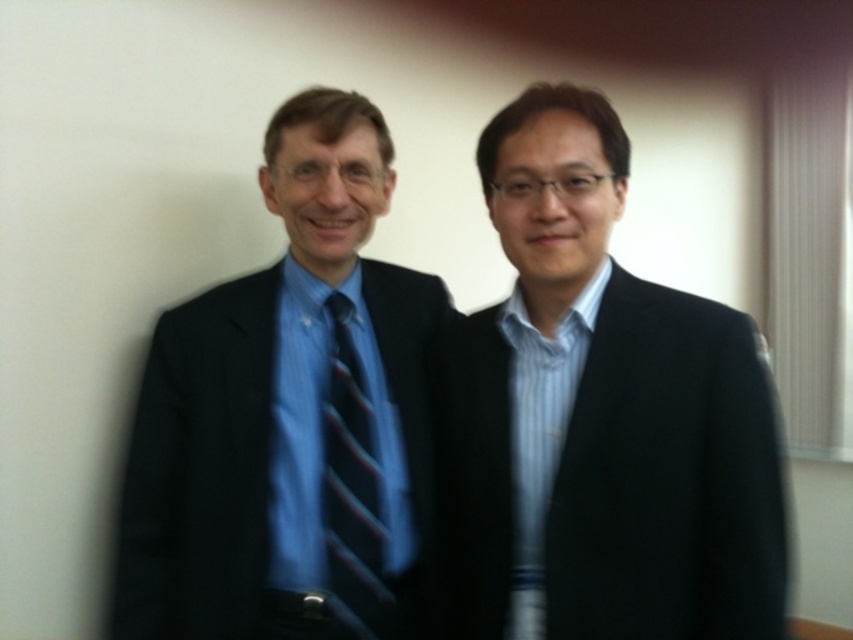
Consider the image. Is matte black suit at right below blue striped tie at center?

No, matte black suit at right is not below blue striped tie at center.

Can you confirm if matte black suit at right is wider than blue striped tie at center?

Correct, the width of matte black suit at right exceeds that of blue striped tie at center.

Is point (596, 289) behind point (370, 532)?

No, it is in front of (370, 532).

In order to click on matte black suit at right in this screenshot , I will do `click(605, 416)`.

Does matte black suit at right have a greater width compared to matte black suit at left?

No, matte black suit at right is not wider than matte black suit at left.

Where is `matte black suit at right`? matte black suit at right is located at coordinates (605, 416).

Who is higher up, matte black suit at left or blue striped tie at center?

matte black suit at left

Is point (128, 611) more distant than point (372, 420)?

No, it is in front of (372, 420).

The height and width of the screenshot is (640, 853). In order to click on matte black suit at left in this screenshot , I will do `click(293, 419)`.